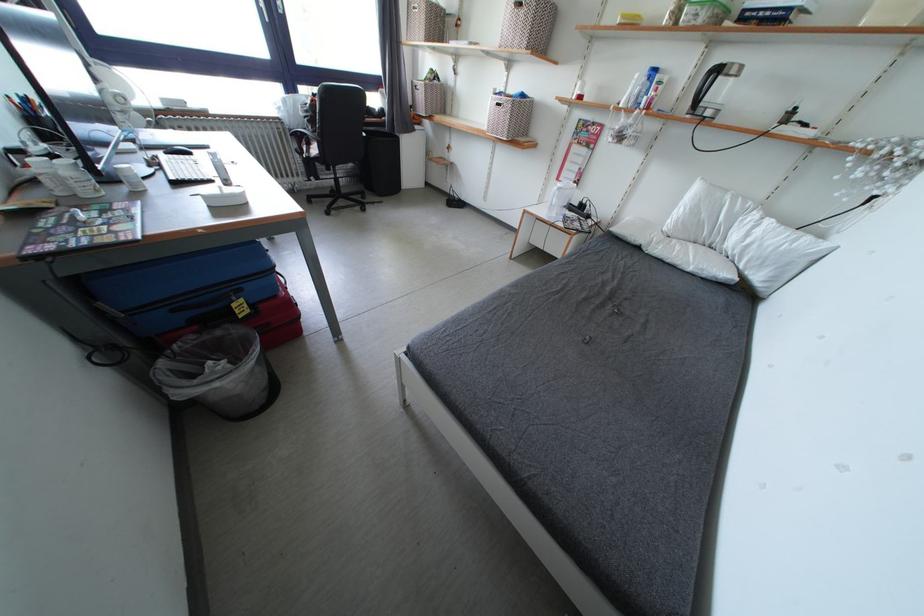
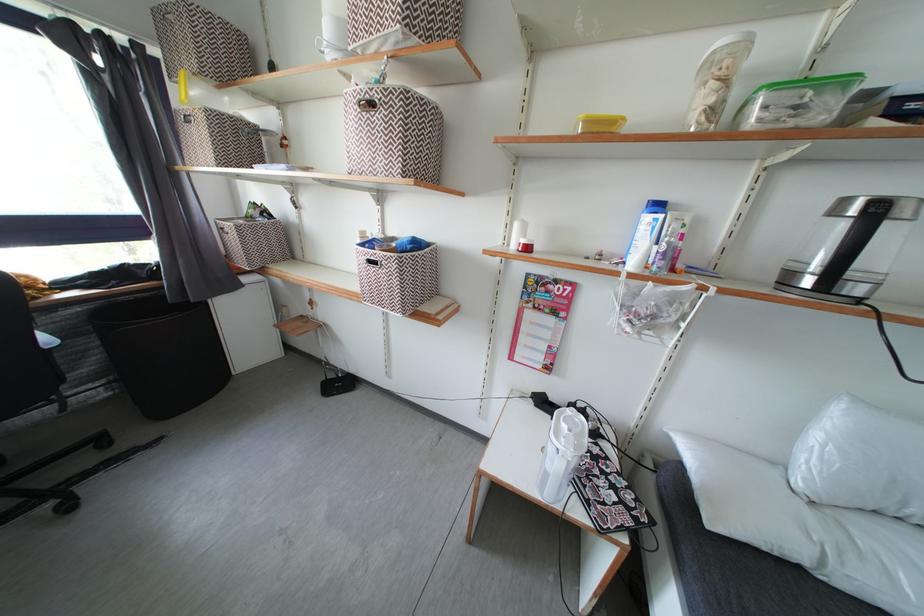
Question: In a continuous first-person perspective shot, in which direction is the camera moving?

Choices:
 (A) Left
 (B) Right
 (C) Forward
 (D) Backward

Answer: (C)